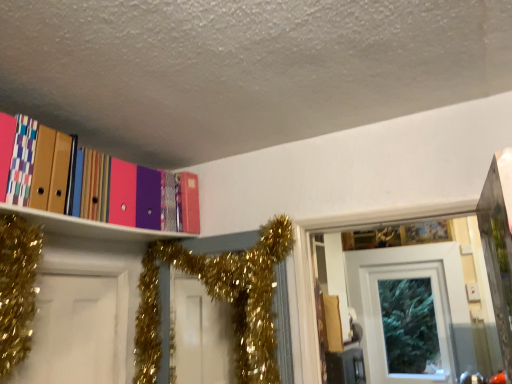
Question: Is white glossy door at upper center aimed at gold glitter garland at upper center?

Choices:
 (A) yes
 (B) no

Answer: (A)

Question: Is white glossy door at upper center to the right of gold glitter garland at upper center from the viewer's perspective?

Choices:
 (A) no
 (B) yes

Answer: (B)

Question: Is gold glitter garland at upper center at the back of white glossy door at upper center?

Choices:
 (A) no
 (B) yes

Answer: (A)

Question: Are white glossy door at upper center and gold glitter garland at upper center beside each other?

Choices:
 (A) no
 (B) yes

Answer: (A)

Question: Considering the relative positions of white glossy door at upper center and gold glitter garland at upper center in the image provided, is white glossy door at upper center to the left of gold glitter garland at upper center from the viewer's perspective?

Choices:
 (A) yes
 (B) no

Answer: (B)

Question: Can you confirm if white glossy door at upper center is thinner than gold glitter garland at upper center?

Choices:
 (A) yes
 (B) no

Answer: (A)

Question: Can you confirm if matte plastic folders at upper left is wider than white glossy door at upper center?

Choices:
 (A) no
 (B) yes

Answer: (B)

Question: Is matte plastic folders at upper left not near white glossy door at upper center?

Choices:
 (A) no
 (B) yes

Answer: (B)

Question: Does matte plastic folders at upper left have a greater height compared to white glossy door at upper center?

Choices:
 (A) yes
 (B) no

Answer: (B)

Question: Is matte plastic folders at upper left at the left side of white glossy door at upper center?

Choices:
 (A) yes
 (B) no

Answer: (A)

Question: Is matte plastic folders at upper left thinner than white glossy door at upper center?

Choices:
 (A) yes
 (B) no

Answer: (B)

Question: From a real-world perspective, does matte plastic folders at upper left stand above white glossy door at upper center?

Choices:
 (A) no
 (B) yes

Answer: (B)

Question: Does gold glitter garland at upper center have a lesser height compared to white glossy door at upper center?

Choices:
 (A) no
 (B) yes

Answer: (B)